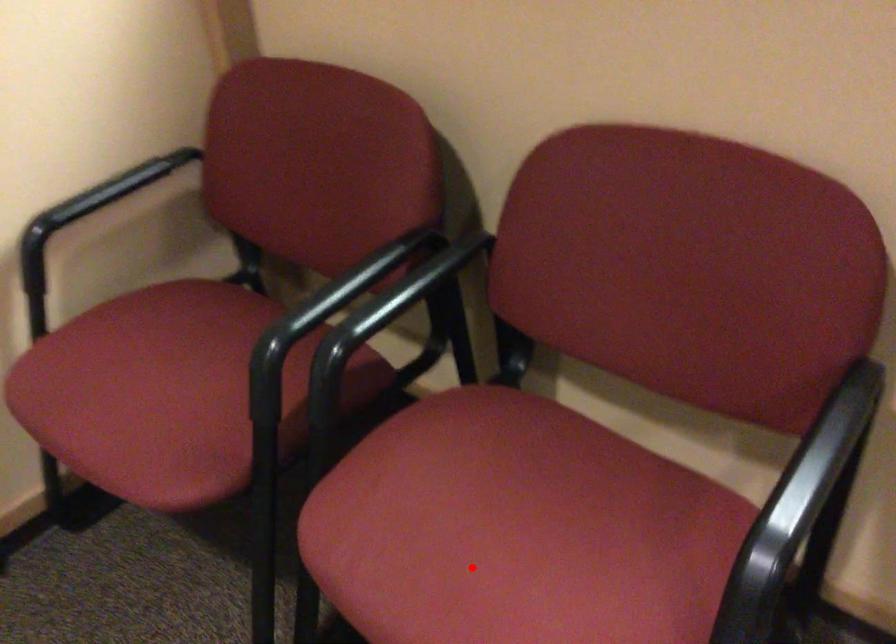
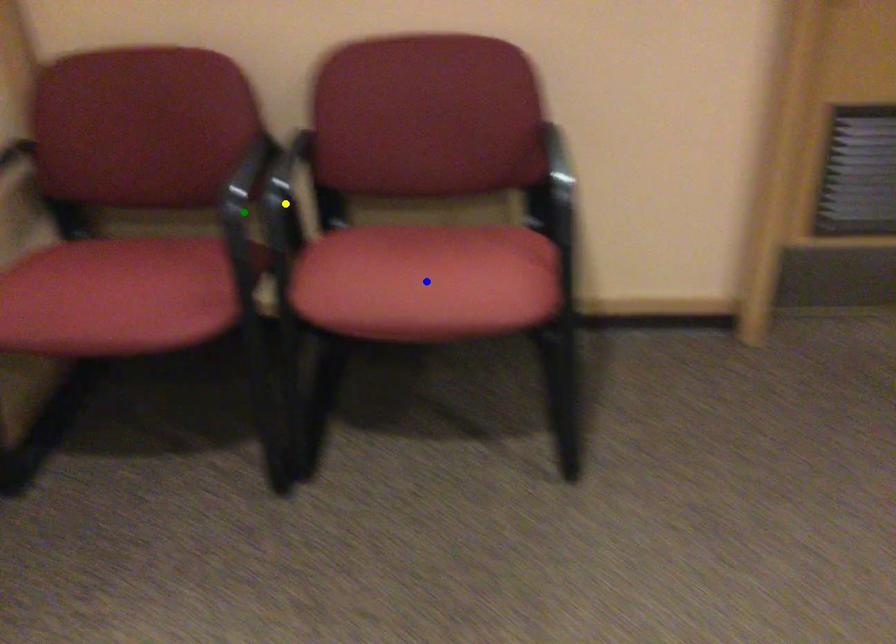
Question: I am providing you with two images of the same scene from different viewpoints. A red point is marked on the first image. You are given multiple points on the second image. Which spot in image 2 lines up with the point in image 1?

Choices:
 (A) yellow point
 (B) blue point
 (C) green point

Answer: (B)